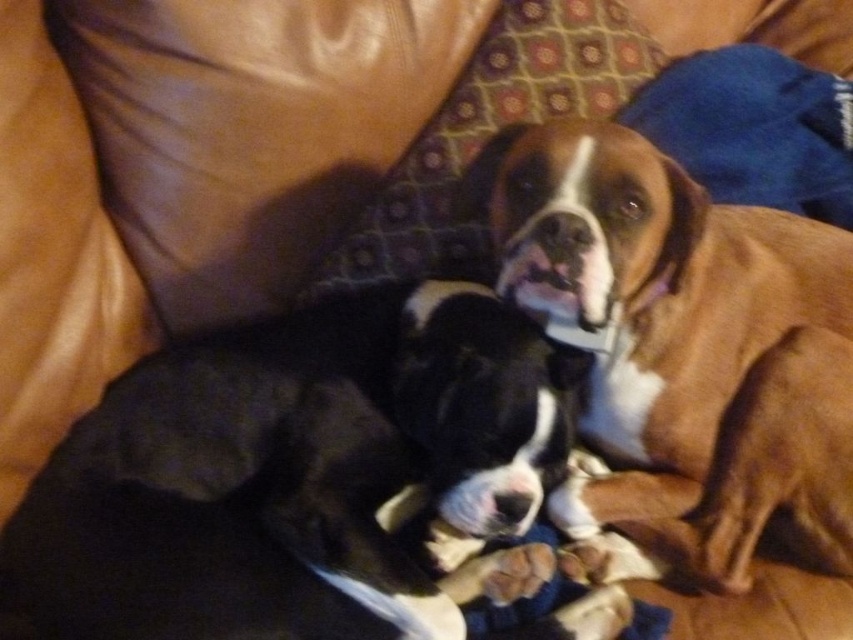
You are a dog owner who wants to place a new dog bed in the living room. The bed must be large enough to accommodate both the brown smooth dog at upper right and the brown fuzzy paw at lower center. Based on their sizes, which dog requires more vertical space for the bed?

The brown smooth dog at upper right requires more vertical space because it is much taller than the brown fuzzy paw at lower center.

You are standing in front of the couch where the two dogs are resting. You want to place a small toy between the two points marked as point (520, 268) and point (532, 577). Which point should the toy be closer to so that it is in front of both points?

The toy should be placed closer to point (520, 268) because it is in front of point (532, 577). This ensures the toy is in front of both points.

You are a dog owner who wants to place a new dog bed for the brown smooth dog at upper right. The dog bed is the same height as the patterned fabric pillow at upper center. Will the dog bed be shorter than the dog?

The brown smooth dog at upper right is taller than the patterned fabric pillow at upper center. Since the dog bed has the same height as the pillow, the dog bed will be shorter than the dog.